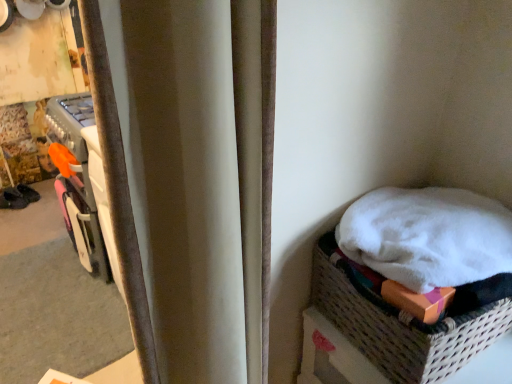
Question: In the image, is white woven basket at lower right on the left side or the right side of dark brown leather shoe at left?

Choices:
 (A) left
 (B) right

Answer: (B)

Question: Does point (423, 327) appear closer or farther from the camera than point (12, 203)?

Choices:
 (A) closer
 (B) farther

Answer: (A)

Question: Which object is the farthest from the white woven basket at lower right?

Choices:
 (A) velvet curtain at center
 (B) dark brown leather shoe at left

Answer: (B)

Question: Which object is the closest to the white woven basket at lower right?

Choices:
 (A) velvet curtain at center
 (B) dark brown leather shoe at left

Answer: (A)